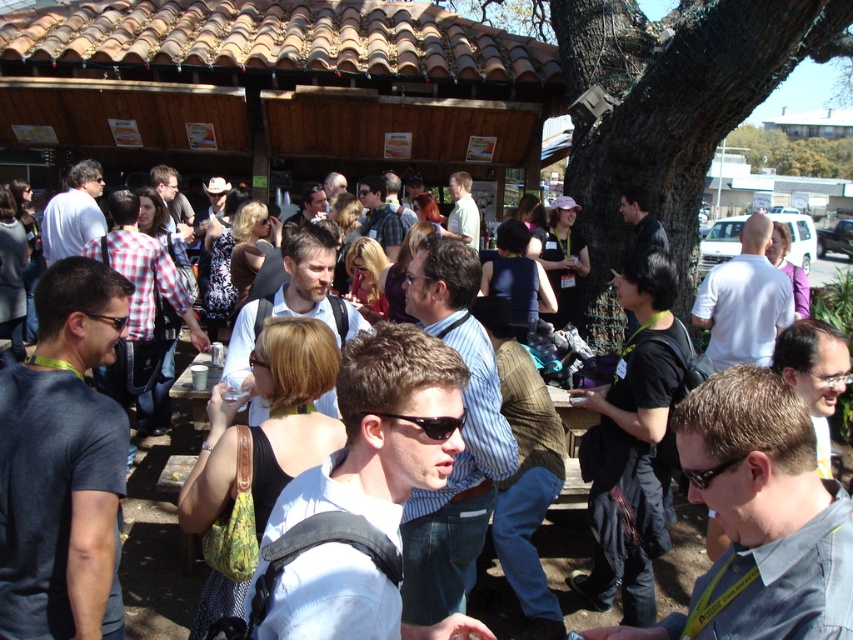
Can you confirm if white shirt at left is positioned above matte black shirt at center?

No, white shirt at left is not above matte black shirt at center.

Looking at this image, can you confirm if white shirt at left is positioned to the right of matte black shirt at center?

Incorrect, white shirt at left is not on the right side of matte black shirt at center.

You are a GUI agent. You are given a task and a screenshot of the screen. Output one action in this format:
    pyautogui.click(x=<x>, y=<y>)
    Task: Click on the white shirt at left
    This screenshot has height=640, width=853.
    Given the screenshot: What is the action you would take?
    73,212

Who is positioned more to the left, dark blue t-shirt at center or black fabric backpack at center?

dark blue t-shirt at center is more to the left.

Between point (35, 385) and point (624, 609), which one is positioned behind?

The point (624, 609) is behind.

The width and height of the screenshot is (853, 640). In order to click on dark blue t-shirt at center in this screenshot , I will do `click(62, 465)`.

Where is `dark blue t-shirt at center`? This screenshot has height=640, width=853. dark blue t-shirt at center is located at coordinates (62, 465).

Describe the element at coordinates (462, 438) in the screenshot. This screenshot has width=853, height=640. I see `blue striped shirt at center` at that location.

You are a GUI agent. You are given a task and a screenshot of the screen. Output one action in this format:
    pyautogui.click(x=<x>, y=<y>)
    Task: Click on the blue striped shirt at center
    The image size is (853, 640).
    Given the screenshot: What is the action you would take?
    pyautogui.click(x=462, y=438)

Does point (442, 294) come in front of point (728, 346)?

Yes, it is in front of point (728, 346).

At what (x,y) coordinates should I click in order to perform the action: click on blue striped shirt at center. Please return your answer as a coordinate pair (x, y). This screenshot has height=640, width=853. Looking at the image, I should click on (462, 438).